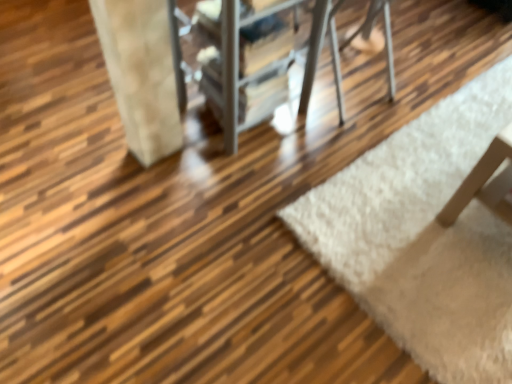
Question: Considering the relative sizes of white fluffy rug at lower right and metallic silver chair at center in the image provided, is white fluffy rug at lower right shorter than metallic silver chair at center?

Choices:
 (A) yes
 (B) no

Answer: (A)

Question: Does white fluffy rug at lower right have a smaller size compared to metallic silver chair at center?

Choices:
 (A) no
 (B) yes

Answer: (B)

Question: From a real-world perspective, does white fluffy rug at lower right stand above metallic silver chair at center?

Choices:
 (A) yes
 (B) no

Answer: (B)

Question: Does white fluffy rug at lower right appear on the left side of metallic silver chair at center?

Choices:
 (A) no
 (B) yes

Answer: (A)

Question: From a real-world perspective, does white fluffy rug at lower right sit lower than metallic silver chair at center?

Choices:
 (A) yes
 (B) no

Answer: (A)

Question: Is white fluffy rug at lower right touching metallic silver chair at center?

Choices:
 (A) no
 (B) yes

Answer: (A)

Question: Is white fluffy rug at lower right a part of metallic silver chair at center?

Choices:
 (A) no
 (B) yes

Answer: (A)

Question: From the image's perspective, is metallic silver chair at center under white fluffy rug at lower right?

Choices:
 (A) yes
 (B) no

Answer: (B)

Question: From the image's perspective, is metallic silver chair at center on white fluffy rug at lower right?

Choices:
 (A) no
 (B) yes

Answer: (B)

Question: Is metallic silver chair at center not near white fluffy rug at lower right?

Choices:
 (A) no
 (B) yes

Answer: (A)

Question: Is metallic silver chair at center not within white fluffy rug at lower right?

Choices:
 (A) no
 (B) yes

Answer: (B)

Question: Is metallic silver chair at center smaller than white fluffy rug at lower right?

Choices:
 (A) no
 (B) yes

Answer: (A)

Question: Is metallic silver chair at center bigger or smaller than white fluffy rug at lower right?

Choices:
 (A) small
 (B) big

Answer: (B)